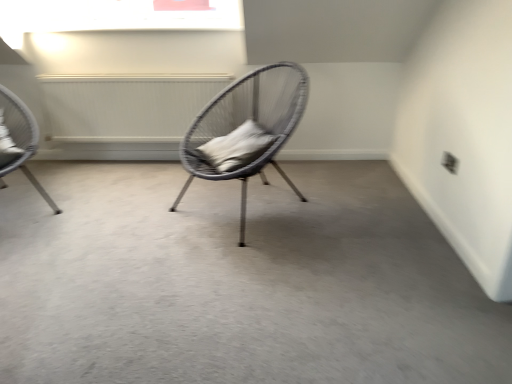
Question: From a real-world perspective, is woven grey chair at center, positioned as the second chair in left-to-right order, positioned under smooth gray carpet at center based on gravity?

Choices:
 (A) no
 (B) yes

Answer: (A)

Question: From a real-world perspective, does woven grey chair at center, positioned as the second chair in left-to-right order, stand above smooth gray carpet at center?

Choices:
 (A) no
 (B) yes

Answer: (B)

Question: Can you confirm if woven grey chair at center, positioned as the second chair in left-to-right order, is taller than smooth gray carpet at center?

Choices:
 (A) no
 (B) yes

Answer: (B)

Question: From the image's perspective, is woven grey chair at center, which appears as the 1th chair when viewed from the right, under smooth gray carpet at center?

Choices:
 (A) no
 (B) yes

Answer: (A)

Question: Considering the relative positions of woven grey chair at center, which appears as the 1th chair when viewed from the right, and smooth gray carpet at center in the image provided, is woven grey chair at center, which appears as the 1th chair when viewed from the right, to the right of smooth gray carpet at center from the viewer's perspective?

Choices:
 (A) yes
 (B) no

Answer: (A)

Question: Based on their sizes in the image, would you say matte wicker chair at left, which is counted as the 1th chair, starting from the left, is bigger or smaller than gray fabric pillow at center?

Choices:
 (A) big
 (B) small

Answer: (A)

Question: Considering the positions of matte wicker chair at left, the 2th chair when ordered from right to left, and gray fabric pillow at center in the image, is matte wicker chair at left, the 2th chair when ordered from right to left, taller or shorter than gray fabric pillow at center?

Choices:
 (A) tall
 (B) short

Answer: (A)

Question: Considering their positions, is matte wicker chair at left, which is counted as the 1th chair, starting from the left, located in front of or behind gray fabric pillow at center?

Choices:
 (A) behind
 (B) front

Answer: (B)

Question: Would you say matte wicker chair at left, which is counted as the 1th chair, starting from the left, is inside or outside gray fabric pillow at center?

Choices:
 (A) outside
 (B) inside

Answer: (A)

Question: Considering the positions of point (113, 124) and point (233, 127), is point (113, 124) closer or farther from the camera than point (233, 127)?

Choices:
 (A) farther
 (B) closer

Answer: (A)

Question: Considering the positions of white textured radiator at upper left and woven grey chair at center, positioned as the second chair in left-to-right order, in the image, is white textured radiator at upper left bigger or smaller than woven grey chair at center, positioned as the second chair in left-to-right order,?

Choices:
 (A) big
 (B) small

Answer: (B)

Question: Is white textured radiator at upper left to the left or to the right of woven grey chair at center, which appears as the 1th chair when viewed from the right, in the image?

Choices:
 (A) left
 (B) right

Answer: (A)

Question: From the image's perspective, relative to woven grey chair at center, positioned as the second chair in left-to-right order, is white textured radiator at upper left above or below?

Choices:
 (A) below
 (B) above

Answer: (B)

Question: From a real-world perspective, is white textured radiator at upper left physically located above or below smooth gray carpet at center?

Choices:
 (A) above
 (B) below

Answer: (A)

Question: From their relative heights in the image, would you say white textured radiator at upper left is taller or shorter than smooth gray carpet at center?

Choices:
 (A) tall
 (B) short

Answer: (A)